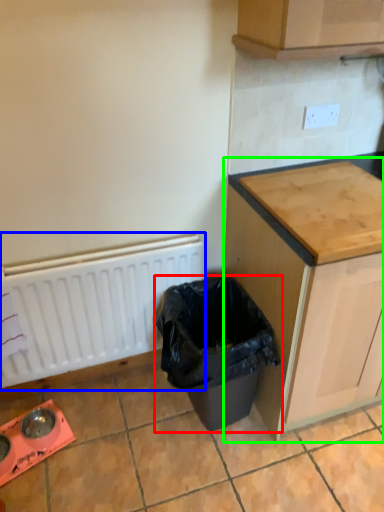
Question: Which object is positioned farthest from waste container (highlighted by a red box)? Select from radiator (highlighted by a blue box) and cabinetry (highlighted by a green box).

Choices:
 (A) radiator
 (B) cabinetry

Answer: (A)